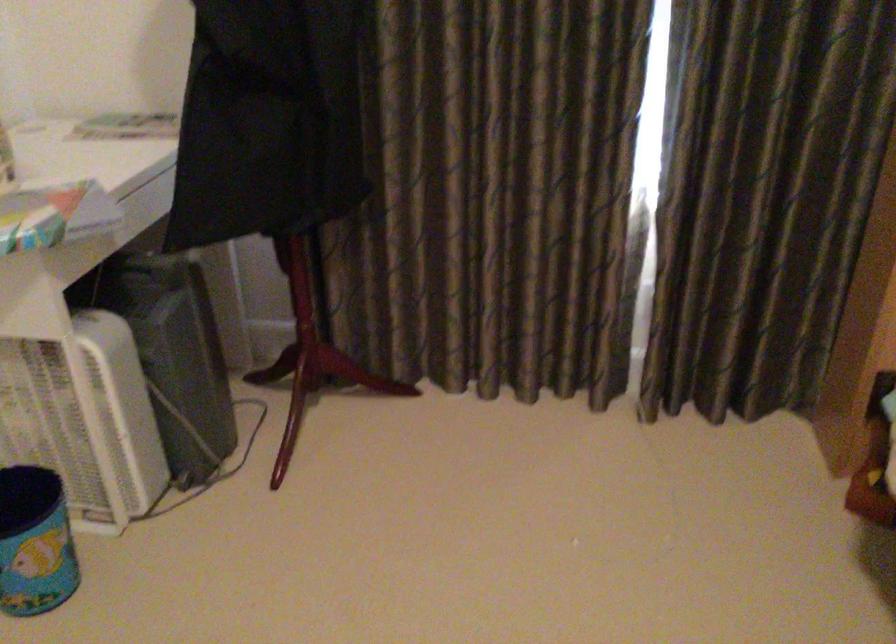
Image resolution: width=896 pixels, height=644 pixels. Find the location of `small patterned bin`. small patterned bin is located at coordinates (35, 542).